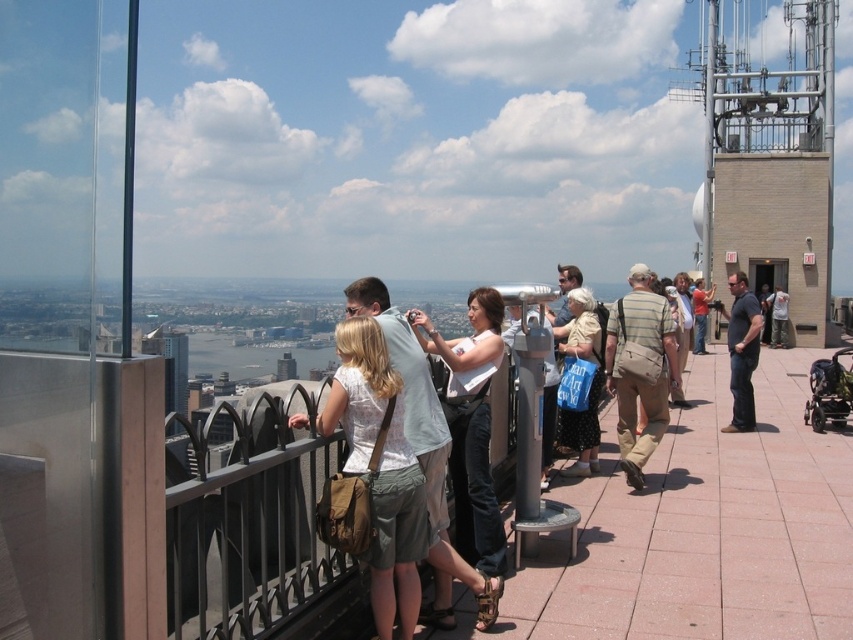
You are standing on the rooftop observation deck and want to pick up the closest bag to you. Which bag should you choose between the matte brown bag at center and the tan canvas bag at center?

The matte brown bag at center is closer to the viewer than the tan canvas bag at center, so you should choose the matte brown bag at center.

You are standing at the point labeled point (576,321) on the rooftop observation deck. If you want to take a photo of the cityscape without any obstructions, should you move closer to or farther away from the camera position?

Since the point labeled point (576,321) is 36.64 meters away from the camera, you should move closer to the camera position to take a photo without obstructions. Being closer to the camera would reduce the distance between you and the camera, potentially allowing for a clearer, unobstructed view of the cityscape.

You are standing on a rooftop observation deck and want to take a photo of the cityscape. You have a tan canvas bag at center and a camera. Which item should you pick up first to start taking photos?

You should pick up the camera first because the tan canvas bag at center and camera are 102.79 feet apart, meaning the camera is closer to you than the tan canvas bag at center.